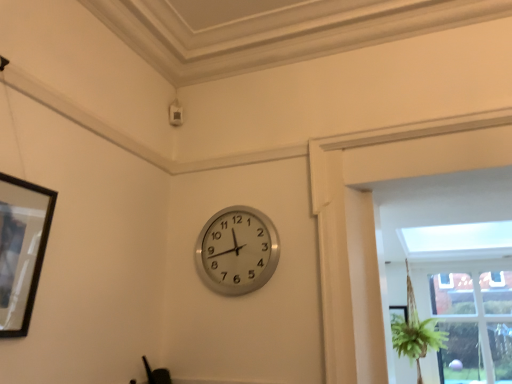
Find the location of `black matte picture frame at left`. black matte picture frame at left is located at coordinates (21, 249).

The image size is (512, 384). What do you see at coordinates (469, 321) in the screenshot?
I see `clear glass window at center right` at bounding box center [469, 321].

Where is `silver metallic clock at center`? This screenshot has height=384, width=512. silver metallic clock at center is located at coordinates (237, 251).

In the scene shown: Measure the distance between silver metallic clock at center and camera.

5.99 feet.

In order to click on black matte picture frame at left in this screenshot , I will do click(21, 249).

Is silver metallic clock at center positioned far away from clear glass window at center right?

Yes, silver metallic clock at center and clear glass window at center right are located far from each other.

Can you tell me how much silver metallic clock at center and clear glass window at center right differ in facing direction?

There is a 0.0971-degree angle between the facing directions of silver metallic clock at center and clear glass window at center right.

From a real-world perspective, is silver metallic clock at center physically below clear glass window at center right?

No.

From the image's perspective, is silver metallic clock at center above clear glass window at center right?

Yes.

Identify the location of wall clock behind the black matte picture frame at left. (237, 251).

Is black matte picture frame at left facing away from silver metallic clock at center?

No, black matte picture frame at left is not facing the opposite direction of silver metallic clock at center.

How different are the orientations of black matte picture frame at left and silver metallic clock at center in degrees?

The angle between the facing direction of black matte picture frame at left and the facing direction of silver metallic clock at center is 90.1 degrees.

Is point (5, 286) less distant than point (206, 259)?

Yes, it is in front of point (206, 259).

Is black matte picture frame at left facing away from clear glass window at center right?

No, clear glass window at center right is not at the back of black matte picture frame at left.

Considering the sizes of objects black matte picture frame at left and clear glass window at center right in the image provided, who is shorter, black matte picture frame at left or clear glass window at center right?

black matte picture frame at left.

From a real-world perspective, is black matte picture frame at left over clear glass window at center right?

Yes, from a real-world perspective, black matte picture frame at left is above clear glass window at center right.

Which object is more forward, black matte picture frame at left or clear glass window at center right?

black matte picture frame at left is closer to the camera.

Between clear glass window at center right and silver metallic clock at center, which one has smaller size?

With smaller size is silver metallic clock at center.

From the picture: Is clear glass window at center right facing away from silver metallic clock at center?

No, clear glass window at center right's orientation is not away from silver metallic clock at center.

The height and width of the screenshot is (384, 512). I want to click on window lying below the silver metallic clock at center (from the image's perspective), so click(469, 321).

Are clear glass window at center right and black matte picture frame at left beside each other?

No, clear glass window at center right is not making contact with black matte picture frame at left.

Is point (488, 323) more distant than point (52, 209)?

Yes, point (488, 323) is behind point (52, 209).

Consider the image. Is clear glass window at center right in front of or behind black matte picture frame at left in the image?

clear glass window at center right is positioned farther from the viewer than black matte picture frame at left.

Considering the sizes of objects clear glass window at center right and black matte picture frame at left in the image provided, who is thinner, clear glass window at center right or black matte picture frame at left?

black matte picture frame at left is thinner.

Which object is closer to the camera, silver metallic clock at center or black matte picture frame at left?

black matte picture frame at left is more forward.

Find the location of a particular element. wall clock on the right of black matte picture frame at left is located at coordinates (237, 251).

Considering the sizes of objects silver metallic clock at center and black matte picture frame at left in the image provided, who is thinner, silver metallic clock at center or black matte picture frame at left?

Thinner between the two is silver metallic clock at center.

Is point (234, 289) positioned in front of point (10, 229)?

No.

This screenshot has height=384, width=512. Find the location of `wall clock located above the clear glass window at center right (from a real-world perspective)`. wall clock located above the clear glass window at center right (from a real-world perspective) is located at coordinates (237, 251).

Where is `wall clock located behind the black matte picture frame at left`? This screenshot has width=512, height=384. wall clock located behind the black matte picture frame at left is located at coordinates (237, 251).

From the image, which object appears to be nearer to black matte picture frame at left, clear glass window at center right or silver metallic clock at center?

silver metallic clock at center.

When comparing their distances from silver metallic clock at center, does clear glass window at center right or black matte picture frame at left seem closer?

The object closer to silver metallic clock at center is black matte picture frame at left.

Looking at the image, which one is located closer to clear glass window at center right, black matte picture frame at left or silver metallic clock at center?

Among the two, silver metallic clock at center is located nearer to clear glass window at center right.

When comparing their distances from clear glass window at center right, does silver metallic clock at center or black matte picture frame at left seem further?

Based on the image, black matte picture frame at left appears to be further to clear glass window at center right.

When comparing their distances from black matte picture frame at left, does silver metallic clock at center or clear glass window at center right seem closer?

Among the two, silver metallic clock at center is located nearer to black matte picture frame at left.

Estimate the real-world distances between objects in this image. Which object is further from silver metallic clock at center, black matte picture frame at left or clear glass window at center right?

clear glass window at center right lies further to silver metallic clock at center than the other object.

I want to click on wall clock situated between black matte picture frame at left and clear glass window at center right from left to right, so click(x=237, y=251).